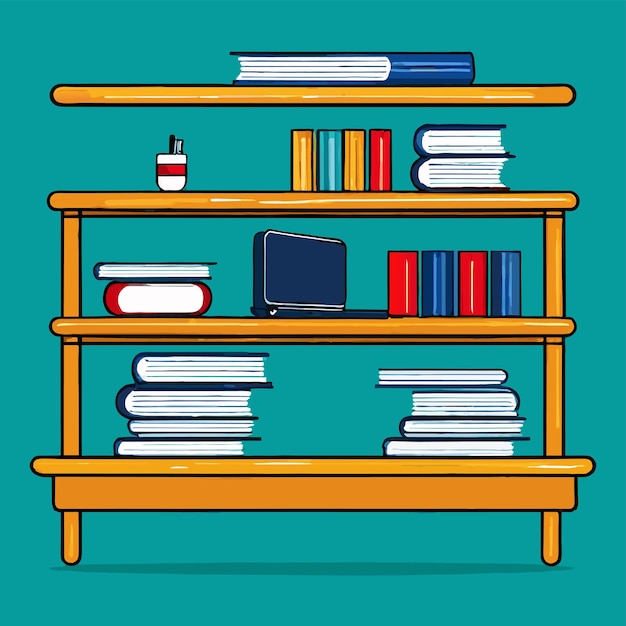
Identify the location of shelf. (200, 85), (238, 206), (250, 332), (309, 464).